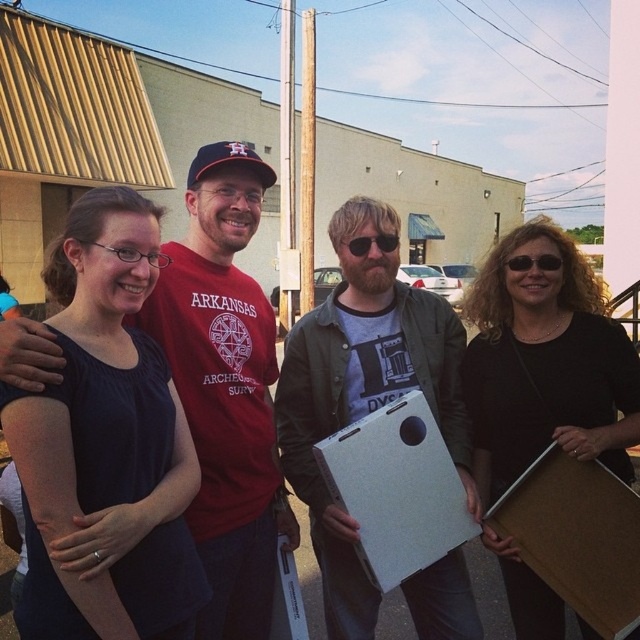
Question: Does white matte cardboard box at center have a larger size compared to black matte sunglasses at center?

Choices:
 (A) no
 (B) yes

Answer: (B)

Question: Can you confirm if matte gray laptop at center is positioned above black matte board at center?

Choices:
 (A) yes
 (B) no

Answer: (B)

Question: Which point is farther from the camera taking this photo?

Choices:
 (A) tap(637, 627)
 (B) tap(394, 528)

Answer: (B)

Question: Which object appears closest to the camera in this image?

Choices:
 (A) white matte cardboard box at center
 (B) brown cardboard at lower right
 (C) matte gray laptop at center

Answer: (B)

Question: Which point is closer to the camera?

Choices:
 (A) white matte cardboard box at center
 (B) matte red t-shirt at center
 (C) black matte sunglasses at center

Answer: (A)

Question: Is matte red t-shirt at center above brown cardboard at lower right?

Choices:
 (A) no
 (B) yes

Answer: (B)